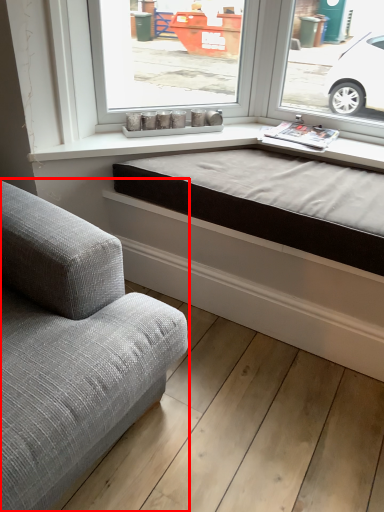
Question: In this image, where is studio couch (annotated by the red box) located relative to bed frame?

Choices:
 (A) right
 (B) left

Answer: (B)